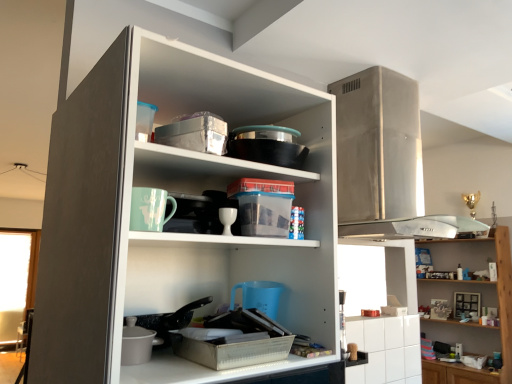
Question: Is white matte cupboard at center to the left of white glossy cup at center from the viewer's perspective?

Choices:
 (A) yes
 (B) no

Answer: (A)

Question: Is white matte cupboard at center facing away from white glossy cup at center?

Choices:
 (A) no
 (B) yes

Answer: (B)

Question: From the image's perspective, is white matte cupboard at center beneath white glossy cup at center?

Choices:
 (A) yes
 (B) no

Answer: (A)

Question: Does white matte cupboard at center have a lesser height compared to white glossy cup at center?

Choices:
 (A) yes
 (B) no

Answer: (B)

Question: Can you confirm if white matte cupboard at center is thinner than white glossy cup at center?

Choices:
 (A) no
 (B) yes

Answer: (A)

Question: Considering the relative positions of white glossy cup at center and white matte cupboard at center in the image provided, is white glossy cup at center to the left or to the right of white matte cupboard at center?

Choices:
 (A) right
 (B) left

Answer: (A)

Question: Is point (224, 223) closer or farther from the camera than point (302, 281)?

Choices:
 (A) closer
 (B) farther

Answer: (A)

Question: From a real-world perspective, relative to white matte cupboard at center, is white glossy cup at center vertically above or below?

Choices:
 (A) above
 (B) below

Answer: (A)

Question: From their relative heights in the image, would you say white glossy cup at center is taller or shorter than white matte cupboard at center?

Choices:
 (A) short
 (B) tall

Answer: (A)

Question: From the image's perspective, is wooden shelves at upper right located above or below white glossy cup at center?

Choices:
 (A) below
 (B) above

Answer: (A)

Question: Does point (435, 286) appear closer or farther from the camera than point (228, 215)?

Choices:
 (A) closer
 (B) farther

Answer: (B)

Question: Is wooden shelves at upper right inside or outside of white glossy cup at center?

Choices:
 (A) inside
 (B) outside

Answer: (B)

Question: Considering the positions of wooden shelves at upper right and white glossy cup at center in the image, is wooden shelves at upper right taller or shorter than white glossy cup at center?

Choices:
 (A) tall
 (B) short

Answer: (A)

Question: Looking at the image, does wooden shelves at upper right seem bigger or smaller compared to white matte cupboard at center?

Choices:
 (A) small
 (B) big

Answer: (B)

Question: Is wooden shelves at upper right in front of or behind white matte cupboard at center in the image?

Choices:
 (A) behind
 (B) front

Answer: (A)